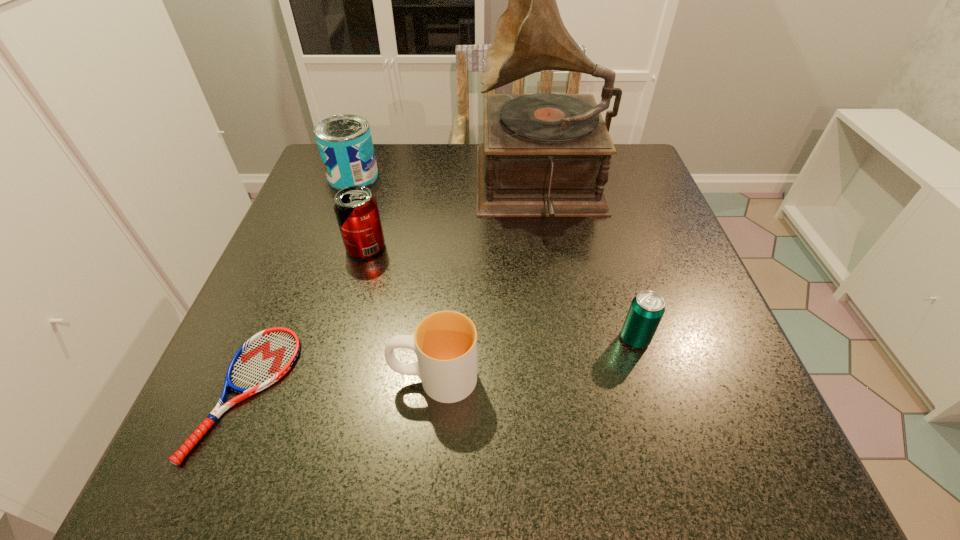
Image resolution: width=960 pixels, height=540 pixels. I want to click on free spot at the right edge of the desktop, so click(x=684, y=256).

Identify the location of vacant area at the far left corner of the desktop. (323, 192).

Find the location of a particular element. vacant space at the far right corner of the desktop is located at coordinates (634, 149).

The image size is (960, 540). I want to click on empty space between the soda can and the beer can, so click(x=500, y=293).

The image size is (960, 540). What are the coordinates of `unoccupied position between the shortest object and the cup` in the screenshot? It's located at (341, 384).

Where is `free space that is in between the cup and the beer can`? The height and width of the screenshot is (540, 960). free space that is in between the cup and the beer can is located at coordinates (535, 358).

Where is `empty space that is in between the cup and the beer can`? This screenshot has height=540, width=960. empty space that is in between the cup and the beer can is located at coordinates (535, 358).

At what (x,y) coordinates should I click in order to perform the action: click on vacant region between the beer can and the cup. Please return your answer as a coordinate pair (x, y). Looking at the image, I should click on (535, 358).

Find the location of `free spot between the record player and the shortest object`. free spot between the record player and the shortest object is located at coordinates [394, 289].

I want to click on unoccupied position between the record player and the beer can, so click(x=588, y=262).